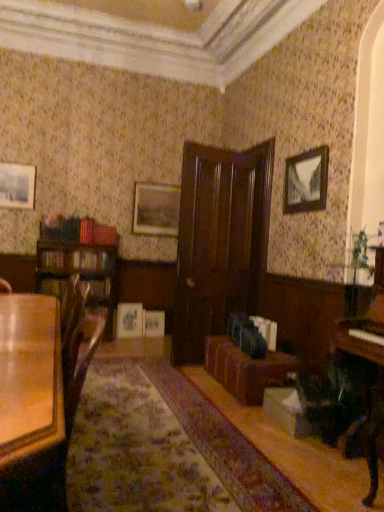
Question: Is matte wooden picture frame at center, positioned as the first picture frame in bottom-to-top order, wider or thinner than wooden picture frame at upper right, the first picture frame when ordered from right to left?

Choices:
 (A) thin
 (B) wide

Answer: (A)

Question: Is matte wooden picture frame at center, marked as the 3th picture frame in a right-to-left arrangement, to the left or to the right of wooden picture frame at upper right, the fifth picture frame from the left, in the image?

Choices:
 (A) right
 (B) left

Answer: (B)

Question: Estimate the real-world distances between objects in this image. Which object is closer to the polished dark wood piano at right?

Choices:
 (A) matte wooden picture frame at upper left, the second picture frame from the front
 (B) wooden picture frame at upper right, placed as the first picture frame when sorted from front to back
 (C) brown leather couch at center
 (D) matte silver picture frame at center, which is the 4th picture frame in left-to-right order
 (E) glossy wood table at lower left

Answer: (C)

Question: Based on their relative distances, which object is farther from the matte white picture frame at center, which appears as the second picture frame when ordered from the bottom?

Choices:
 (A) matte wooden picture frame at center, marked as the fifth picture frame in a top-to-bottom arrangement
 (B) glossy wood table at lower left
 (C) dark wood door at center
 (D) brown leather couch at center
 (E) matte silver picture frame at center, the 3th picture frame in the top-to-bottom sequence

Answer: (B)